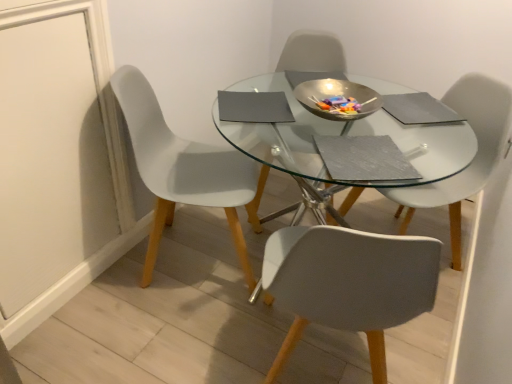
Measure the distance between point (295, 63) and camera.

A distance of 2.13 meters exists between point (295, 63) and camera.

Where is `white plastic chair at center, which is counted as the 1th chair, starting from the right`? white plastic chair at center, which is counted as the 1th chair, starting from the right is located at coordinates (471, 162).

Where is `matte gray chair at center, which ranks as the second chair in left-to-right order`? This screenshot has height=384, width=512. matte gray chair at center, which ranks as the second chair in left-to-right order is located at coordinates (313, 55).

What's the angular difference between white plastic chair at center, the 3th chair when ordered from left to right, and white plastic chair at left, which ranks as the 1th chair in left-to-right order,'s facing directions?

There is a 154-degree angle between the facing directions of white plastic chair at center, the 3th chair when ordered from left to right, and white plastic chair at left, which ranks as the 1th chair in left-to-right order.

Which of these two, white plastic chair at center, the 3th chair when ordered from left to right, or white plastic chair at left, which ranks as the 1th chair in left-to-right order, stands shorter?

With less height is white plastic chair at center, the 3th chair when ordered from left to right.

In the scene shown: Does white plastic chair at center, the 3th chair when ordered from left to right, contain white plastic chair at left, the third chair positioned from the right?

No, white plastic chair at left, the third chair positioned from the right, is not inside white plastic chair at center, the 3th chair when ordered from left to right.

Is white plastic chair at center, the 3th chair when ordered from left to right, next to white plastic chair at left, which ranks as the 1th chair in left-to-right order?

No, white plastic chair at center, the 3th chair when ordered from left to right, is not in contact with white plastic chair at left, which ranks as the 1th chair in left-to-right order.

Between transparent glass table at center and white plastic chair at left, which ranks as the 1th chair in left-to-right order, which one has more height?

white plastic chair at left, which ranks as the 1th chair in left-to-right order.

Is transparent glass table at center facing away from white plastic chair at left, which ranks as the 1th chair in left-to-right order?

No, white plastic chair at left, which ranks as the 1th chair in left-to-right order, is not at the back of transparent glass table at center.

Is transparent glass table at center next to white plastic chair at left, the third chair positioned from the right?

No, transparent glass table at center is not touching white plastic chair at left, the third chair positioned from the right.

Can you confirm if matte gray chair at center, positioned as the 2th chair in right-to-left order, is smaller than white plastic chair at center, the 3th chair when ordered from left to right?

No, matte gray chair at center, positioned as the 2th chair in right-to-left order, is not smaller than white plastic chair at center, the 3th chair when ordered from left to right.

From the image's perspective, is matte gray chair at center, positioned as the 2th chair in right-to-left order, beneath white plastic chair at center, which is counted as the 1th chair, starting from the right?

No, from the image's perspective, matte gray chair at center, positioned as the 2th chair in right-to-left order, is not below white plastic chair at center, which is counted as the 1th chair, starting from the right.

Between matte gray chair at center, positioned as the 2th chair in right-to-left order, and white plastic chair at center, the 3th chair when ordered from left to right, which one has larger width?

matte gray chair at center, positioned as the 2th chair in right-to-left order.

What's the angular difference between matte gray chair at center, which ranks as the second chair in left-to-right order, and white plastic chair at center, the 3th chair when ordered from left to right,'s facing directions?

61.2 degrees.

Is white plastic chair at left, which ranks as the 1th chair in left-to-right order, taller or shorter than matte gray chair at center, positioned as the 2th chair in right-to-left order?

Clearly, white plastic chair at left, which ranks as the 1th chair in left-to-right order, is taller compared to matte gray chair at center, positioned as the 2th chair in right-to-left order.

Where is `the 2nd chair above the white plastic chair at left, which ranks as the 1th chair in left-to-right order (from the image's perspective)`? The width and height of the screenshot is (512, 384). the 2nd chair above the white plastic chair at left, which ranks as the 1th chair in left-to-right order (from the image's perspective) is located at coordinates (313, 55).

Between white plastic chair at left, which ranks as the 1th chair in left-to-right order, and matte gray chair at center, which ranks as the second chair in left-to-right order, which one has larger size?

With larger size is white plastic chair at left, which ranks as the 1th chair in left-to-right order.

Between white plastic chair at left, the third chair positioned from the right, and matte gray chair at center, which ranks as the second chair in left-to-right order, which one is positioned in front?

white plastic chair at left, the third chair positioned from the right, is in front.

Could you tell me if transparent glass table at center is facing white plastic chair at center, the 3th chair when ordered from left to right?

No, transparent glass table at center is not facing towards white plastic chair at center, the 3th chair when ordered from left to right.

Is point (390, 127) more distant than point (431, 191)?

Yes, it is.

From the picture: Which is more to the left, transparent glass table at center or white plastic chair at center, the 3th chair when ordered from left to right?

From the viewer's perspective, transparent glass table at center appears more on the left side.

Looking at this image, considering the relative sizes of transparent glass table at center and white plastic chair at center, the 3th chair when ordered from left to right, in the image provided, is transparent glass table at center shorter than white plastic chair at center, the 3th chair when ordered from left to right,?

Indeed, transparent glass table at center has a lesser height compared to white plastic chair at center, the 3th chair when ordered from left to right.

Consider the image. Is white plastic chair at center, the 3th chair when ordered from left to right, in front of transparent glass table at center?

No.

What's the angular difference between white plastic chair at center, the 3th chair when ordered from left to right, and transparent glass table at center's facing directions?

The angle between the facing direction of white plastic chair at center, the 3th chair when ordered from left to right, and the facing direction of transparent glass table at center is 46.7 degrees.

From a real-world perspective, which is physically below, white plastic chair at center, the 3th chair when ordered from left to right, or transparent glass table at center?

In real-world perspective, transparent glass table at center is lower.

Are white plastic chair at center, the 3th chair when ordered from left to right, and transparent glass table at center far apart?

white plastic chair at center, the 3th chair when ordered from left to right, is near transparent glass table at center, not far away.

From a real-world perspective, which is physically above, white plastic chair at center, which is counted as the 1th chair, starting from the right, or matte gray chair at center, which ranks as the second chair in left-to-right order?

From a 3D spatial view, matte gray chair at center, which ranks as the second chair in left-to-right order, is above.

Is point (405, 222) closer to viewer compared to point (312, 47)?

That is False.

Can you confirm if white plastic chair at center, which is counted as the 1th chair, starting from the right, is positioned to the right of matte gray chair at center, positioned as the 2th chair in right-to-left order?

Yes, white plastic chair at center, which is counted as the 1th chair, starting from the right, is to the right of matte gray chair at center, positioned as the 2th chair in right-to-left order.

From the image's perspective, is white plastic chair at center, the 3th chair when ordered from left to right, below matte gray chair at center, positioned as the 2th chair in right-to-left order?

Correct, white plastic chair at center, the 3th chair when ordered from left to right, appears lower than matte gray chair at center, positioned as the 2th chair in right-to-left order, in the image.

The height and width of the screenshot is (384, 512). Identify the location of chair below the white plastic chair at center, which is counted as the 1th chair, starting from the right (from the image's perspective). (182, 168).

Image resolution: width=512 pixels, height=384 pixels. In order to click on round table on the right of white plastic chair at left, which ranks as the 1th chair in left-to-right order in this screenshot , I will do `click(348, 134)`.

Consider the image. From the image, which object appears to be farther from white plastic chair at center, which is counted as the 1th chair, starting from the right, white plastic chair at left, which ranks as the 1th chair in left-to-right order, or transparent glass table at center?

Among the two, white plastic chair at left, which ranks as the 1th chair in left-to-right order, is located further to white plastic chair at center, which is counted as the 1th chair, starting from the right.

When comparing their distances from transparent glass table at center, does white plastic chair at left, the third chair positioned from the right, or white plastic chair at center, which is counted as the 1th chair, starting from the right, seem further?

white plastic chair at left, the third chair positioned from the right, is further to transparent glass table at center.

Looking at the image, which one is located closer to white plastic chair at left, which ranks as the 1th chair in left-to-right order, white plastic chair at center, which is counted as the 1th chair, starting from the right, or matte gray chair at center, positioned as the 2th chair in right-to-left order?

The object closer to white plastic chair at left, which ranks as the 1th chair in left-to-right order, is matte gray chair at center, positioned as the 2th chair in right-to-left order.

Considering their positions, is transparent glass table at center positioned further to white plastic chair at center, which is counted as the 1th chair, starting from the right, than white plastic chair at left, which ranks as the 1th chair in left-to-right order?

Based on the image, white plastic chair at left, which ranks as the 1th chair in left-to-right order, appears to be further to white plastic chair at center, which is counted as the 1th chair, starting from the right.

Based on their spatial positions, is white plastic chair at left, the third chair positioned from the right, or matte gray chair at center, which ranks as the second chair in left-to-right order, closer to transparent glass table at center?

matte gray chair at center, which ranks as the second chair in left-to-right order, is closer to transparent glass table at center.

Considering their positions, is transparent glass table at center positioned closer to matte gray chair at center, positioned as the 2th chair in right-to-left order, than white plastic chair at left, the third chair positioned from the right?

The object closer to matte gray chair at center, positioned as the 2th chair in right-to-left order, is transparent glass table at center.

Considering their positions, is white plastic chair at center, the 3th chair when ordered from left to right, positioned closer to matte gray chair at center, positioned as the 2th chair in right-to-left order, than white plastic chair at left, the third chair positioned from the right?

white plastic chair at center, the 3th chair when ordered from left to right, is closer to matte gray chair at center, positioned as the 2th chair in right-to-left order.

Looking at the image, which one is located further to white plastic chair at center, the 3th chair when ordered from left to right, transparent glass table at center or matte gray chair at center, positioned as the 2th chair in right-to-left order?

matte gray chair at center, positioned as the 2th chair in right-to-left order.

Identify the location of chair between white plastic chair at left, the third chair positioned from the right, and white plastic chair at center, which is counted as the 1th chair, starting from the right, in the horizontal direction. This screenshot has height=384, width=512. (313, 55).

Where is `round table between white plastic chair at left, which ranks as the 1th chair in left-to-right order, and white plastic chair at center, which is counted as the 1th chair, starting from the right, in the horizontal direction`? This screenshot has height=384, width=512. round table between white plastic chair at left, which ranks as the 1th chair in left-to-right order, and white plastic chair at center, which is counted as the 1th chair, starting from the right, in the horizontal direction is located at coordinates (348, 134).